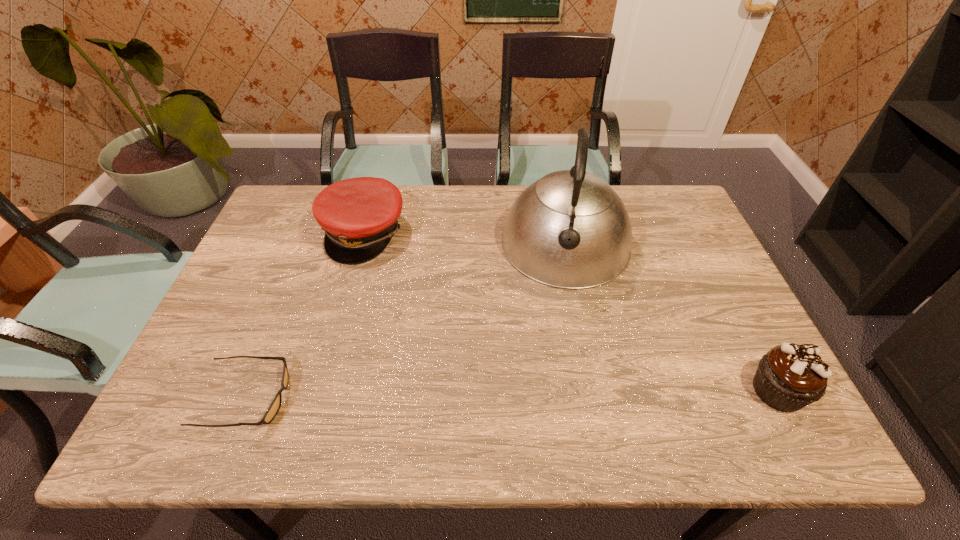
This screenshot has width=960, height=540. I want to click on vacant area that lies between the shortest object and the cap, so click(x=305, y=315).

The height and width of the screenshot is (540, 960). In order to click on free spot between the rightmost object and the shortest object in this screenshot , I will do `click(513, 394)`.

Image resolution: width=960 pixels, height=540 pixels. Find the location of `vacant area between the second object from right to left and the rightmost object`. vacant area between the second object from right to left and the rightmost object is located at coordinates (672, 318).

In order to click on unoccupied position between the cupcake and the cap in this screenshot , I will do `click(571, 312)`.

The width and height of the screenshot is (960, 540). Find the location of `vacant point located between the rightmost object and the sunglasses`. vacant point located between the rightmost object and the sunglasses is located at coordinates (513, 394).

Find the location of a particular element. Image resolution: width=960 pixels, height=540 pixels. free point between the cupcake and the kettle is located at coordinates (672, 318).

Locate an element on the screen. blank region between the cap and the second object from right to left is located at coordinates (465, 239).

The height and width of the screenshot is (540, 960). I want to click on object that is the second closest to the tallest object, so click(x=359, y=215).

Locate which object is the closest to the cap. Please provide its 2D coordinates. Your answer should be formatted as a tuple, i.e. [(x, y)], where the tuple contains the x and y coordinates of a point satisfying the conditions above.

[(570, 229)]